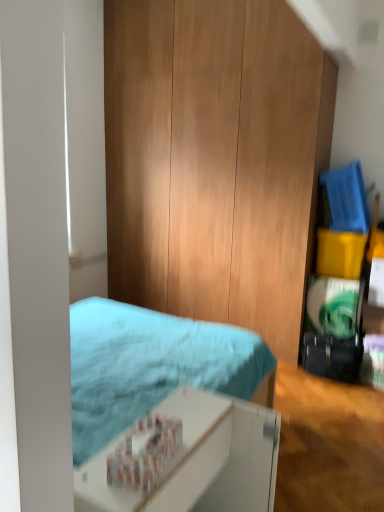
Consider the image. In order to face yellow matte box at right, should I rotate leftwards or rightwards?

Turn right by 19.657 degrees to look at yellow matte box at right.

Where is `yellow matte box at right`? yellow matte box at right is located at coordinates (340, 253).

The width and height of the screenshot is (384, 512). What do you see at coordinates (340, 253) in the screenshot?
I see `yellow matte box at right` at bounding box center [340, 253].

The image size is (384, 512). What do you see at coordinates (168, 409) in the screenshot?
I see `white cardboard box at lower center` at bounding box center [168, 409].

I want to click on white cardboard box at lower center, so click(168, 409).

This screenshot has width=384, height=512. Find the location of `yellow matte box at right`. yellow matte box at right is located at coordinates (340, 253).

Between yellow matte box at right and white cardboard box at lower center, which one appears on the right side from the viewer's perspective?

yellow matte box at right is more to the right.

Is yellow matte box at right in front of white cardboard box at lower center?

No, yellow matte box at right is further to the viewer.

Considering the positions of points (319, 263) and (269, 492), is point (319, 263) closer to camera compared to point (269, 492)?

No.

From the image's perspective, is yellow matte box at right located beneath white cardboard box at lower center?

No, from the image's perspective, yellow matte box at right is not beneath white cardboard box at lower center.

From a real-world perspective, does yellow matte box at right stand above white cardboard box at lower center?

Correct, in the physical world, yellow matte box at right is higher than white cardboard box at lower center.

Between yellow matte box at right and white cardboard box at lower center, which one has smaller width?

With smaller width is white cardboard box at lower center.

Considering the sizes of objects yellow matte box at right and white cardboard box at lower center in the image provided, who is shorter, yellow matte box at right or white cardboard box at lower center?

Standing shorter between the two is yellow matte box at right.

From the picture: Is yellow matte box at right bigger or smaller than white cardboard box at lower center?

Clearly, yellow matte box at right is smaller in size than white cardboard box at lower center.

Is yellow matte box at right not within white cardboard box at lower center?

Yes, yellow matte box at right is not within white cardboard box at lower center.

Can you see yellow matte box at right touching white cardboard box at lower center?

They are not placed beside each other.

Looking at this image, is yellow matte box at right facing away from white cardboard box at lower center?

That's not correct — yellow matte box at right is not looking away from white cardboard box at lower center.

How many degrees apart are the facing directions of yellow matte box at right and white cardboard box at lower center?

yellow matte box at right and white cardboard box at lower center are facing 88.4 degrees away from each other.

Locate an element on the screen. Image resolution: width=384 pixels, height=512 pixels. box that is above the white cardboard box at lower center (from a real-world perspective) is located at coordinates (340, 253).

Considering the positions of objects white cardboard box at lower center and yellow matte box at right in the image provided, who is more to the left, white cardboard box at lower center or yellow matte box at right?

white cardboard box at lower center is more to the left.

Is the position of white cardboard box at lower center more distant than that of yellow matte box at right?

No, the depth of white cardboard box at lower center is less than that of yellow matte box at right.

Does point (219, 469) lie behind point (356, 263)?

No.

From the image's perspective, is white cardboard box at lower center located above yellow matte box at right?

Actually, white cardboard box at lower center appears below yellow matte box at right in the image.

From a real-world perspective, is white cardboard box at lower center over yellow matte box at right?

Actually, white cardboard box at lower center is physically below yellow matte box at right in the real world.

In the scene shown: Considering the sizes of objects white cardboard box at lower center and yellow matte box at right in the image provided, who is thinner, white cardboard box at lower center or yellow matte box at right?

With smaller width is white cardboard box at lower center.

Considering the relative sizes of white cardboard box at lower center and yellow matte box at right in the image provided, is white cardboard box at lower center taller than yellow matte box at right?

Yes, white cardboard box at lower center is taller than yellow matte box at right.

Can you confirm if white cardboard box at lower center is bigger than yellow matte box at right?

Yes.

Is yellow matte box at right completely or partially inside white cardboard box at lower center?

No, yellow matte box at right is not surrounded by white cardboard box at lower center.

Is the surface of white cardboard box at lower center in direct contact with yellow matte box at right?

No, white cardboard box at lower center is not in contact with yellow matte box at right.

Is white cardboard box at lower center facing towards yellow matte box at right?

No, white cardboard box at lower center does not turn towards yellow matte box at right.

What's the angular difference between white cardboard box at lower center and yellow matte box at right's facing directions?

white cardboard box at lower center and yellow matte box at right are facing 88.4 degrees away from each other.

Image resolution: width=384 pixels, height=512 pixels. Find the location of `bed that is under the yellow matte box at right (from a real-world perspective)`. bed that is under the yellow matte box at right (from a real-world perspective) is located at coordinates (168, 409).

You are a GUI agent. You are given a task and a screenshot of the screen. Output one action in this format:
    pyautogui.click(x=<x>, y=<y>)
    Task: Click on the box that appears behind the white cardboard box at lower center
    
    Given the screenshot: What is the action you would take?
    340,253

The width and height of the screenshot is (384, 512). Identify the location of bed in front of the yellow matte box at right. (168, 409).